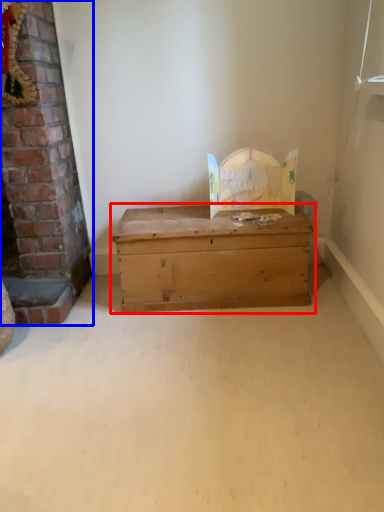
Question: Which object is further to the camera taking this photo, table (highlighted by a red box) or fireplace (highlighted by a blue box)?

Choices:
 (A) table
 (B) fireplace

Answer: (A)